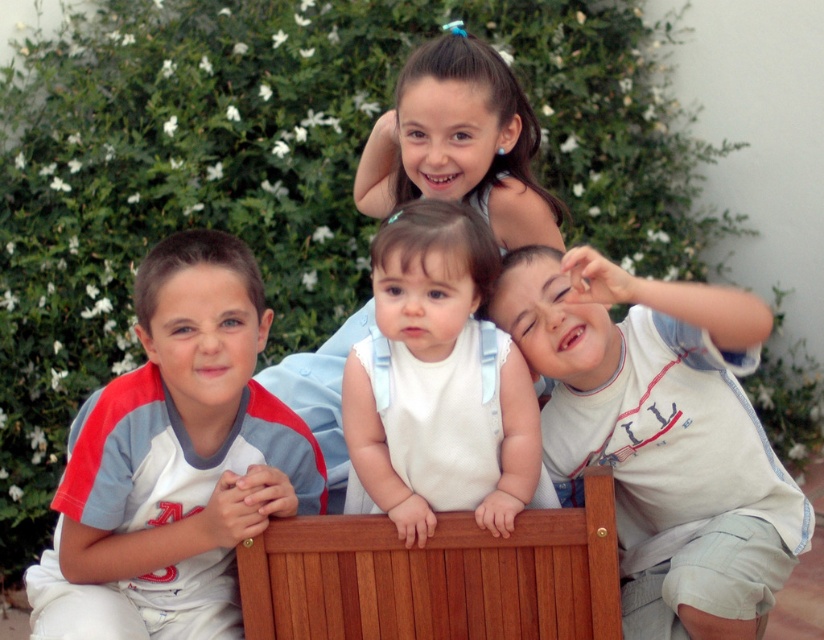
Looking at this image, you are a photographer setting up a photo shoot for the children sitting on the wooden bench at center and wearing the smooth blue dress at upper center. Based on their heights, which object is shorter?

The wooden bench at center is not as tall as the smooth blue dress at upper center, so the wooden bench at center is shorter.

You are a photographer trying to capture a group shot of the children. You want to ensure that the child in the white cotton shirt at right and the child in the smooth blue dress at upper center are both in the frame. Based on their positions, which child should you focus on first to ensure both are centered?

The white cotton shirt at right is positioned on the right side of smooth blue dress at upper center. Therefore, you should focus on the smooth blue dress at upper center first, as it is closer to the center of the frame, ensuring both children are included.

You are a photographer trying to capture the children in the scene. You notice the light blue fabric shirt at left and the smooth blue dress at upper center. Which clothing item is closer to the camera?

The light blue fabric shirt at left is closer to the camera because it is in front of the smooth blue dress at upper center.